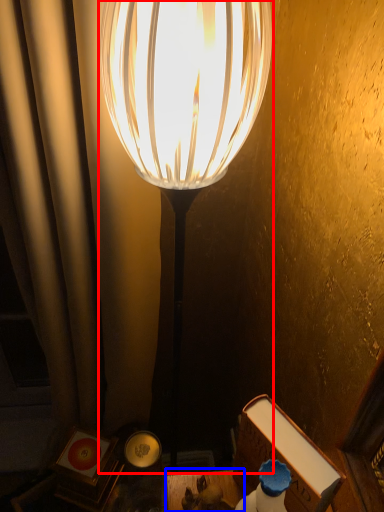
Question: Which point is further to the camera, lamp (highlighted by a red box) or table (highlighted by a blue box)?

Choices:
 (A) lamp
 (B) table

Answer: (B)